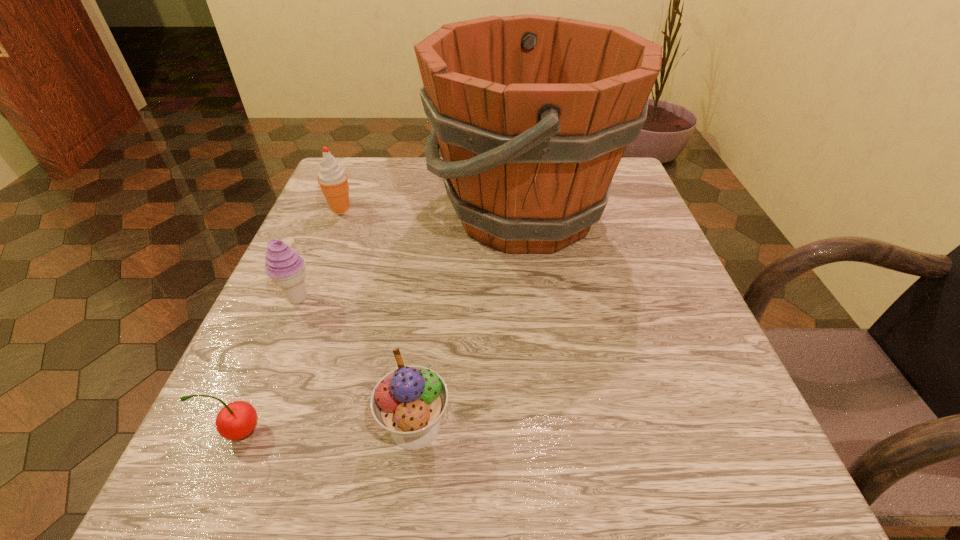
Locate an element on the screen. free point between the cherry and the farthest icecream is located at coordinates coord(290,319).

This screenshot has width=960, height=540. I want to click on free space between the tallest object and the second farthest icecream, so click(x=411, y=255).

Locate an element on the screen. Image resolution: width=960 pixels, height=540 pixels. empty space that is in between the bucket and the cherry is located at coordinates (382, 321).

Identify the location of vacant area that lies between the farthest icecream and the shortest object. (290, 319).

Identify the location of free point between the cherry and the bucket. The height and width of the screenshot is (540, 960). (382, 321).

Locate an element on the screen. The image size is (960, 540). free space between the cherry and the rightmost icecream is located at coordinates (327, 429).

Identify the location of vacant area that lies between the farthest icecream and the cherry. (290, 319).

Identify the location of vacant area that lies between the farthest icecream and the nearest icecream. This screenshot has width=960, height=540. (377, 318).

I want to click on free space between the rightmost icecream and the farthest icecream, so click(x=377, y=318).

Where is `object that is the second closest to the nearest icecream`? The height and width of the screenshot is (540, 960). object that is the second closest to the nearest icecream is located at coordinates click(532, 114).